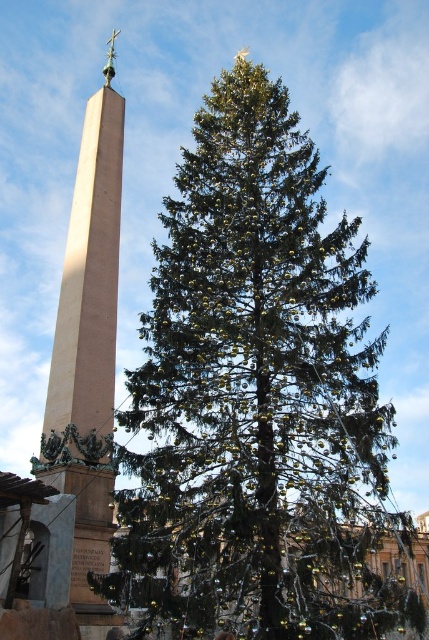
Between point (175, 458) and point (96, 504), which one is positioned behind?

Point (175, 458)

Does green textured pine tree at center have a greater width compared to smooth beige obelisk at left?

Correct, the width of green textured pine tree at center exceeds that of smooth beige obelisk at left.

Identify the location of green textured pine tree at center. (256, 397).